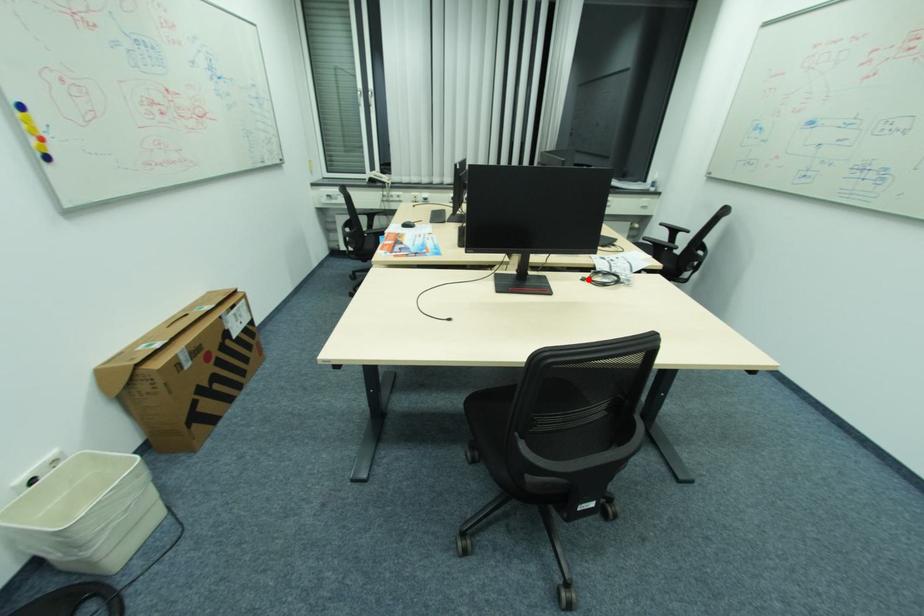
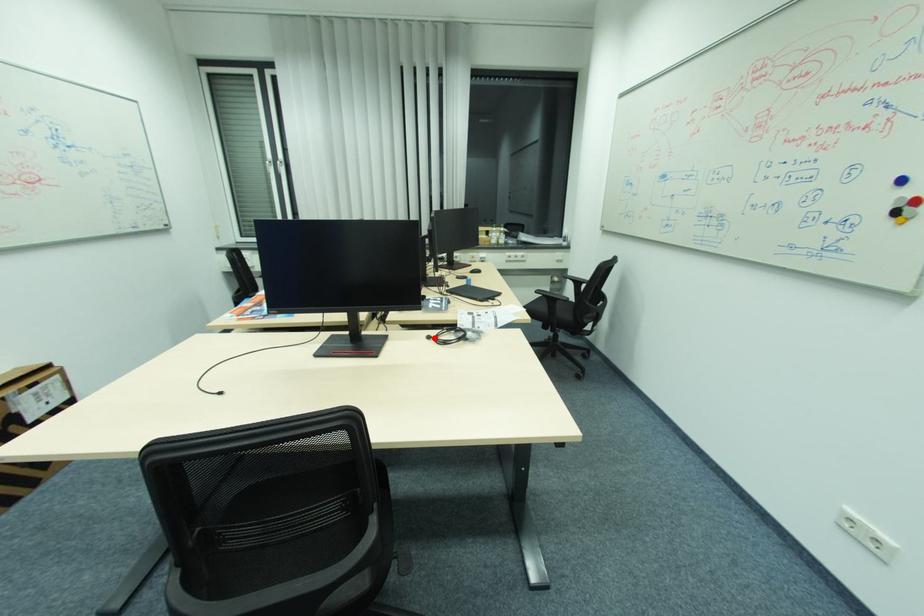
I am providing you with two images of the same scene from different viewpoints. A red point is marked on the first image and another point is marked on the second image. Is the red point in image1 aligned with the point shown in image2?

Yes